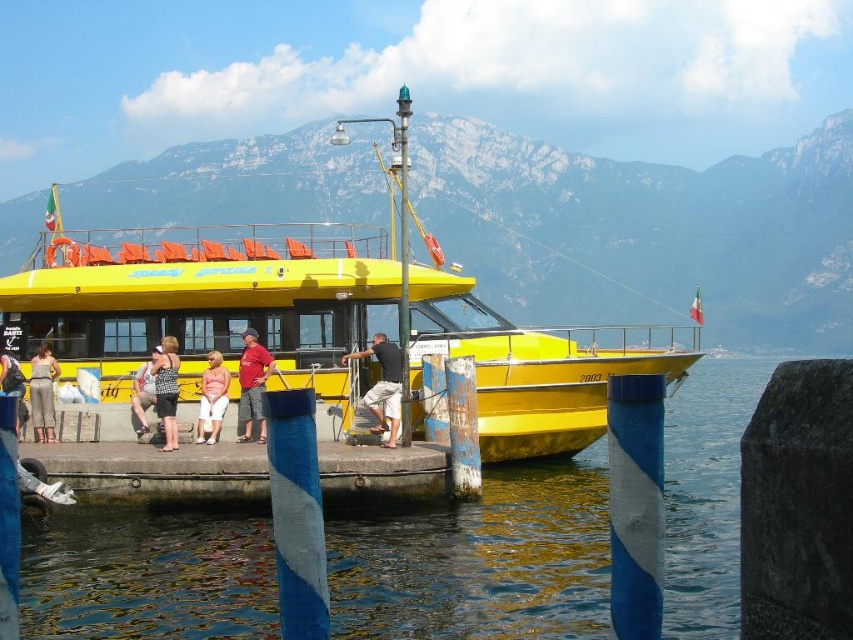
Which is below, matte black dress at lower left or matte black tank top at left?

matte black tank top at left

Is point (171, 356) more distant than point (148, 381)?

Yes, point (171, 356) is behind point (148, 381).

In order to click on matte black dress at lower left in this screenshot , I will do `click(166, 388)`.

Can you confirm if yellow matte boat at center is bigger than concrete dock at lower center?

Indeed, yellow matte boat at center has a larger size compared to concrete dock at lower center.

How distant is yellow matte boat at center from concrete dock at lower center?

The distance of yellow matte boat at center from concrete dock at lower center is 47.78 meters.

The image size is (853, 640). In order to click on yellow matte boat at center in this screenshot , I will do `click(314, 321)`.

What are the coordinates of `yellow matte boat at center` in the screenshot? It's located at (314, 321).

Who is more distant from viewer, (534, 337) or (141, 394)?

The point (534, 337) is more distant.

Can you confirm if yellow matte boat at center is smaller than matte black tank top at left?

Actually, yellow matte boat at center might be larger than matte black tank top at left.

Is point (142, 310) positioned before point (161, 352)?

That is False.

Locate an element on the screen. yellow matte boat at center is located at coordinates pos(314,321).